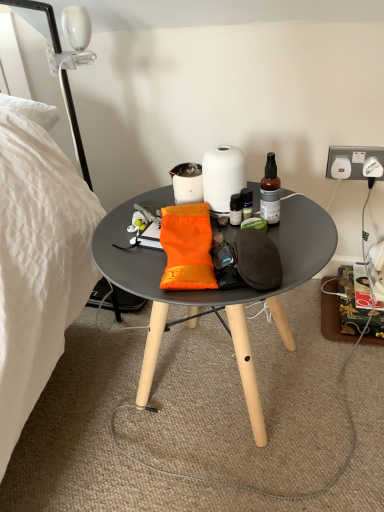
The image size is (384, 512). I want to click on free region on the left part of matte black table at center, so click(x=82, y=394).